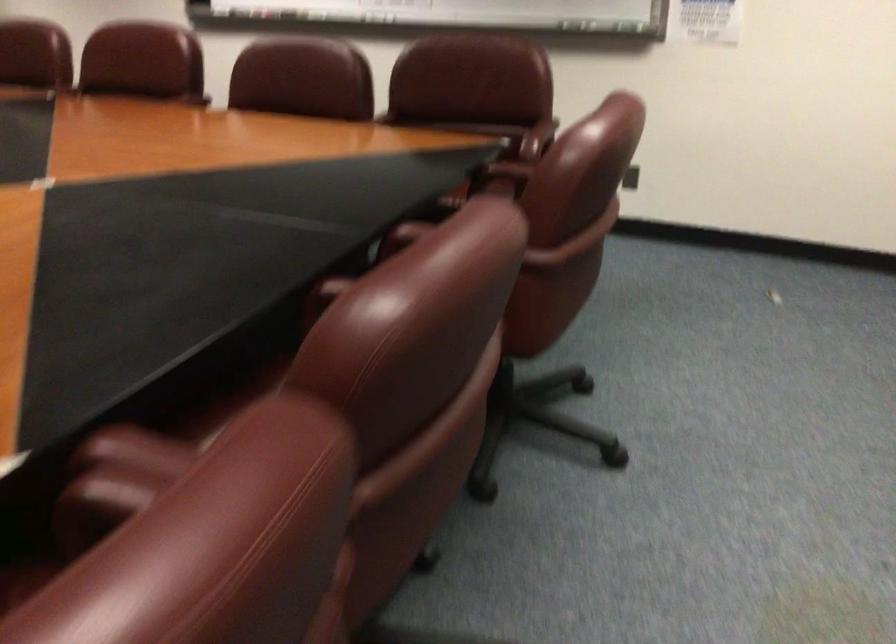
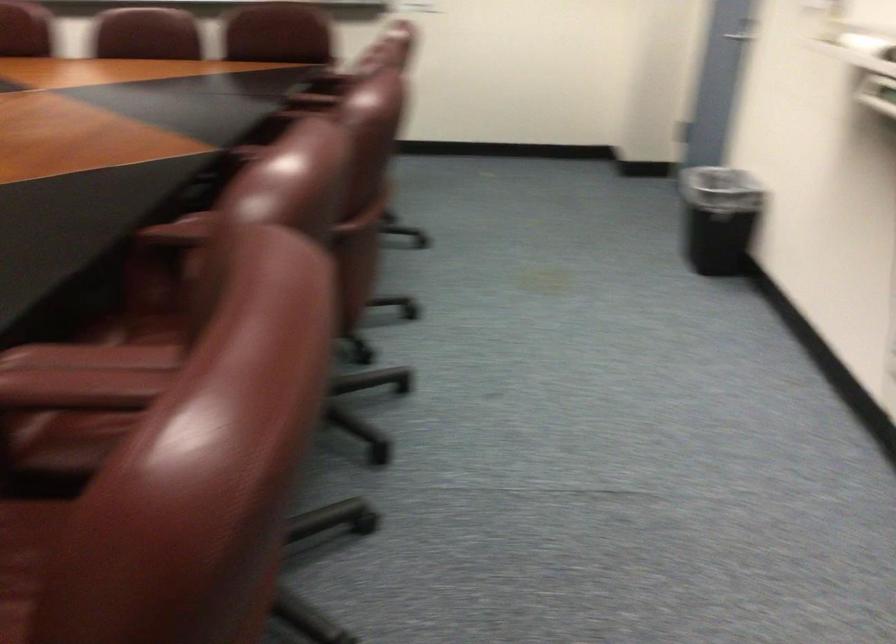
How did the camera likely rotate?

The camera rotated toward right-down.